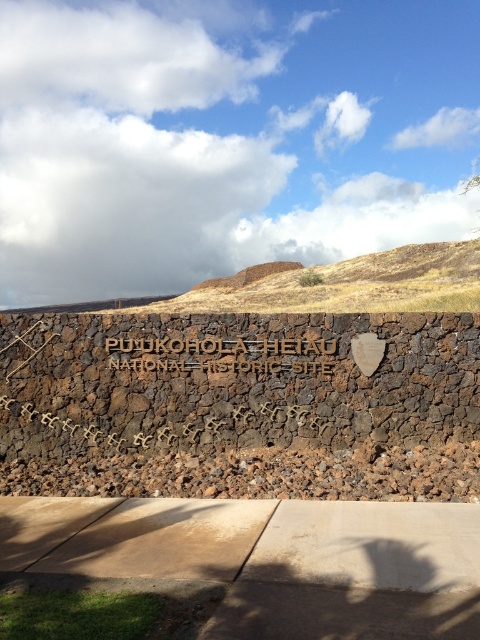
You are standing on the paved pathway in front of the stone wall. You want to read the gold textured sign at center but notice the brown volcanic rock at center is blocking your view. Can you step aside to see the sign clearly?

The gold textured sign at center is behind the brown volcanic rock at center, so stepping aside might not help because the rock is blocking the sign. You may need to move around to the side where the sign is visible beyond the rock.

You are a visitor standing in front of the stone wall with the engraved text. You notice the brown volcanic rock at center and the gold textured sign at center. Which object is larger in size?

The gold textured sign at center is larger in size compared to the brown volcanic rock at center.

You are a visitor at the historic site and want to take a photo of the gold textured sign at center. To avoid blocking the sign with your body, you need to stand to its left. Is the brown volcanic rock at center in the way of your photo? Please explain.

The brown volcanic rock at center is positioned on the left side of the gold textured sign at center. Since you want to stand to the left of the sign, the brown volcanic rock at center will be between you and the sign, potentially blocking your view. Choose a different spot to take the photo.